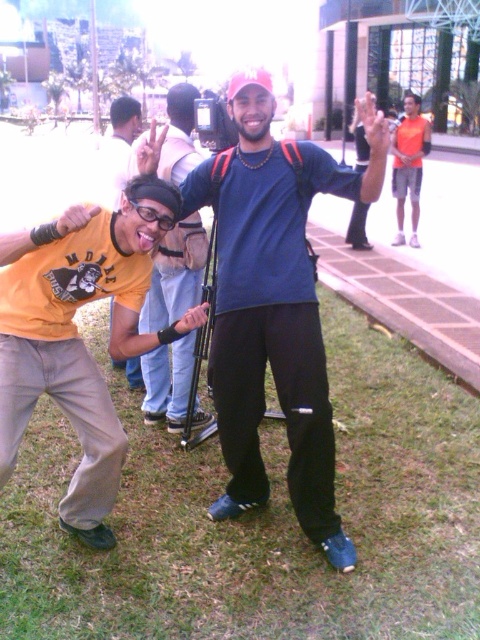
You are a photographer trying to capture the perfect shot of the blue matte shirt at center and the orange mesh shirt at upper right. Which of the two shirts should you focus on first if you want to capture them in order from top to bottom?

The orange mesh shirt at upper right is positioned above the blue matte shirt at center, so you should focus on the orange mesh shirt at upper right first to capture them from top to bottom.

Consider the image. You are a photographer trying to adjust the framing of your shot. You have two subjects in the frame, the blue matte shirt at center and the orange mesh shirt at upper right. Based on their sizes in the image, which one should you focus on to ensure they appear larger in the final photo?

The orange mesh shirt at upper right should be focused on because it has a greater height compared to the blue matte shirt at center, making it appear larger in the photo.